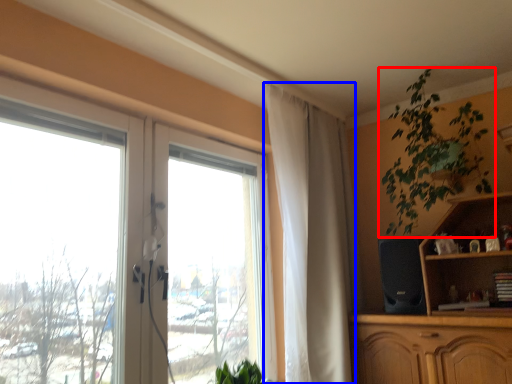
Question: Which object is closer to the camera taking this photo, houseplant (highlighted by a red box) or curtain (highlighted by a blue box)?

Choices:
 (A) houseplant
 (B) curtain

Answer: (A)